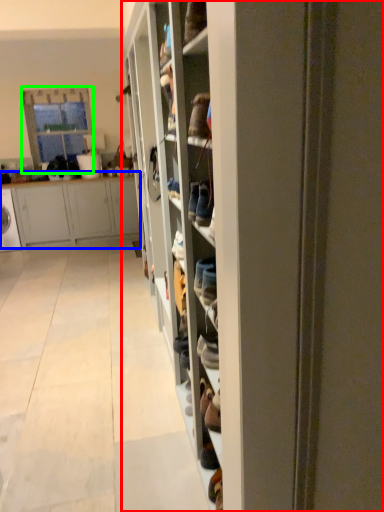
Question: Based on their relative distances, which object is farther from shelf (highlighted by a red box)? Choose from cabinetry (highlighted by a blue box) and glass door (highlighted by a green box).

Choices:
 (A) cabinetry
 (B) glass door

Answer: (B)